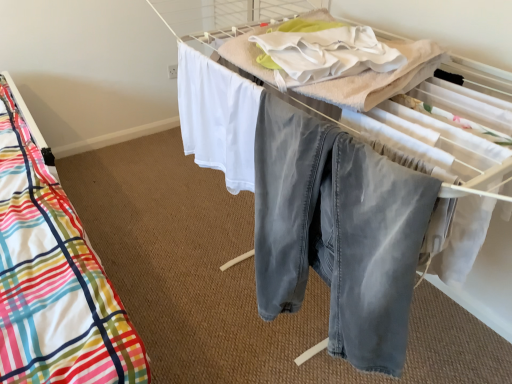
Question: From the image's perspective, is plaid fabric bed at left on denim pants at center?

Choices:
 (A) no
 (B) yes

Answer: (B)

Question: Is plaid fabric bed at left behind denim pants at center?

Choices:
 (A) yes
 (B) no

Answer: (A)

Question: Considering the relative sizes of plaid fabric bed at left and denim pants at center in the image provided, is plaid fabric bed at left taller than denim pants at center?

Choices:
 (A) yes
 (B) no

Answer: (A)

Question: Would you say denim pants at center is part of plaid fabric bed at left's contents?

Choices:
 (A) no
 (B) yes

Answer: (A)

Question: Is plaid fabric bed at left outside of denim pants at center?

Choices:
 (A) no
 (B) yes

Answer: (B)

Question: From a real-world perspective, is white cotton blanket at upper center above or below plaid fabric bed at left?

Choices:
 (A) below
 (B) above

Answer: (B)

Question: Is white cotton blanket at upper center in front of or behind plaid fabric bed at left in the image?

Choices:
 (A) behind
 (B) front

Answer: (B)

Question: Does point (251, 56) appear closer or farther from the camera than point (453, 102)?

Choices:
 (A) closer
 (B) farther

Answer: (B)

Question: Based on their sizes in the image, would you say white cotton blanket at upper center is bigger or smaller than plaid fabric bed at left?

Choices:
 (A) big
 (B) small

Answer: (B)

Question: Do you think denim pants at center is within plaid fabric bed at left, or outside of it?

Choices:
 (A) inside
 (B) outside

Answer: (B)

Question: Relative to plaid fabric bed at left, is denim pants at center in front or behind?

Choices:
 (A) behind
 (B) front

Answer: (B)

Question: Considering the positions of denim pants at center and plaid fabric bed at left in the image, is denim pants at center bigger or smaller than plaid fabric bed at left?

Choices:
 (A) big
 (B) small

Answer: (B)

Question: Looking at their shapes, would you say denim pants at center is wider or thinner than plaid fabric bed at left?

Choices:
 (A) thin
 (B) wide

Answer: (A)

Question: From a real-world perspective, is denim pants at center above or below white cotton blanket at upper center?

Choices:
 (A) below
 (B) above

Answer: (A)

Question: From the image's perspective, is denim pants at center above or below white cotton blanket at upper center?

Choices:
 (A) below
 (B) above

Answer: (A)